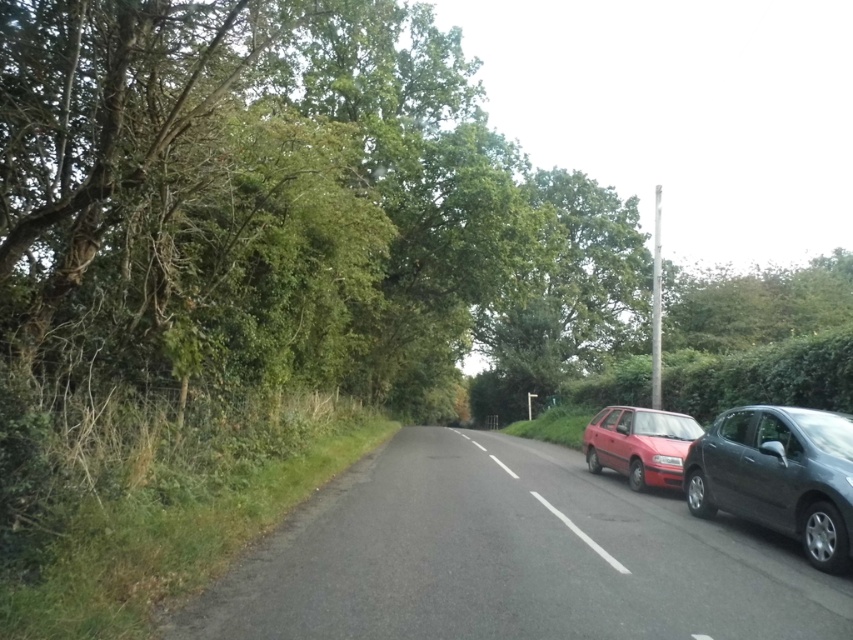
You are a pedestrian standing at the edge of the road. You see the metallic gray hatchback at right and the red plastic license plate at center. Which object is nearer to you?

The metallic gray hatchback at right is closer to the viewer than the red plastic license plate at center.

You are a pedestrian standing at the edge of the road near the dense greenery. You see the metallic gray hatchback at right and the red plastic license plate at center. Which object is closer to the road center?

The red plastic license plate at center is closer to the road center because the metallic gray hatchback at right is positioned to its right side.